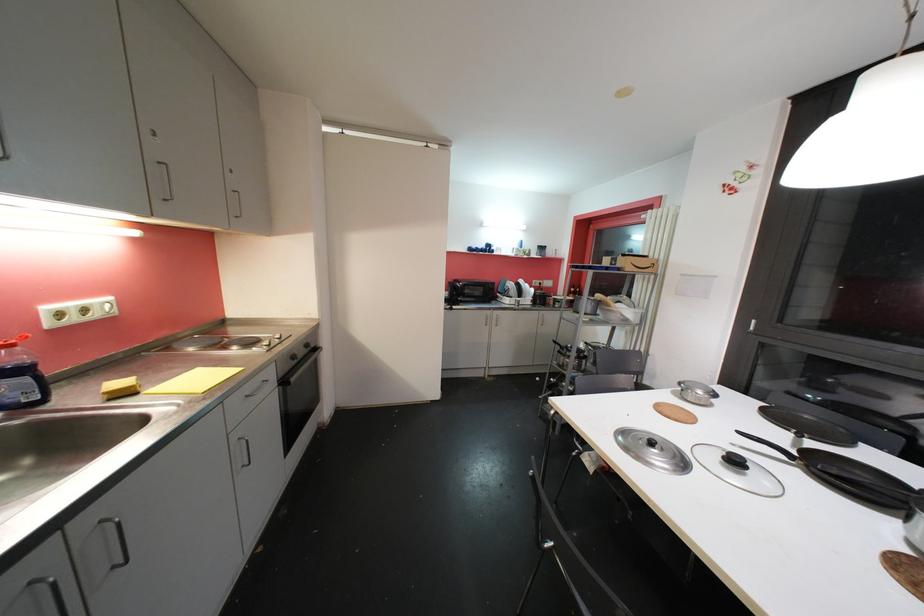
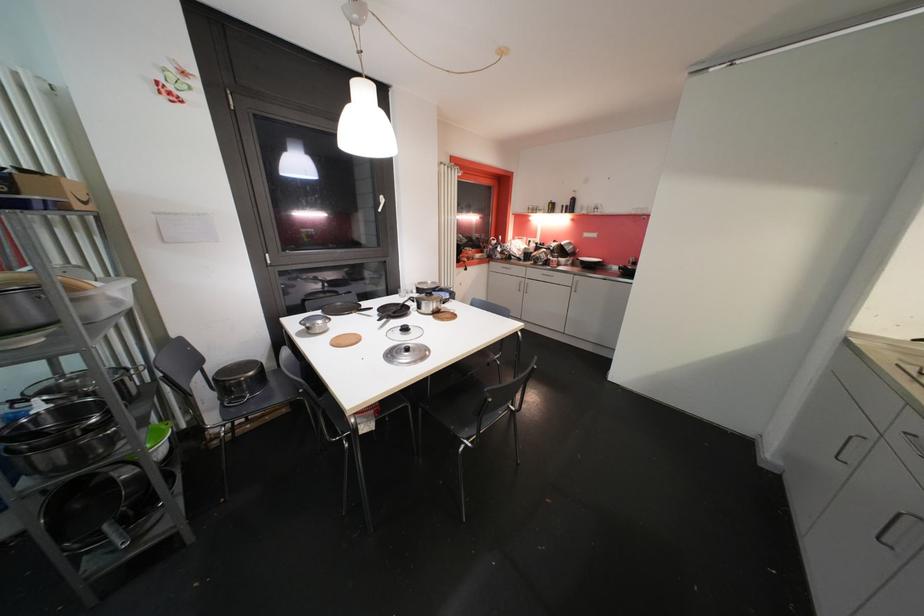
Find the pixel in the second image that matches (693,392) in the first image.

(319, 328)